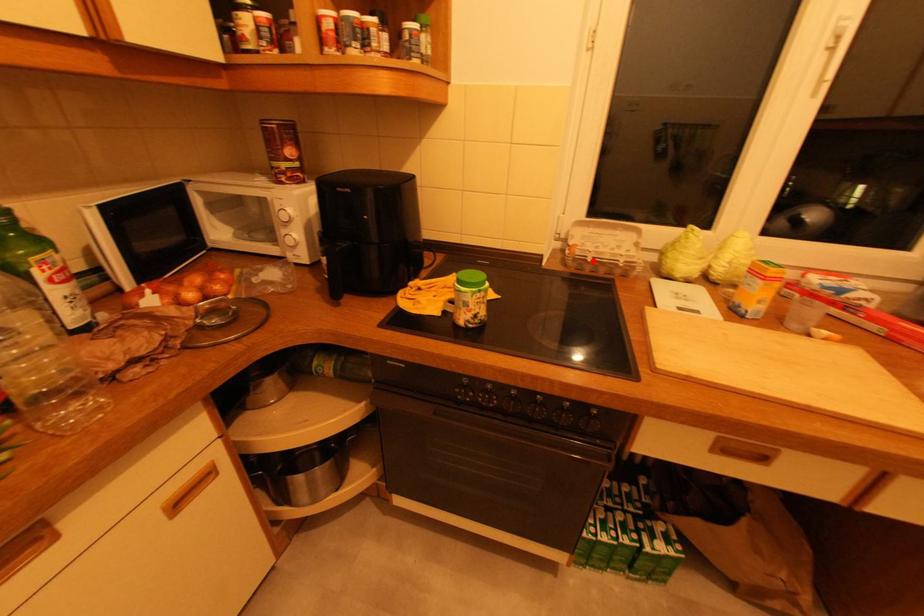
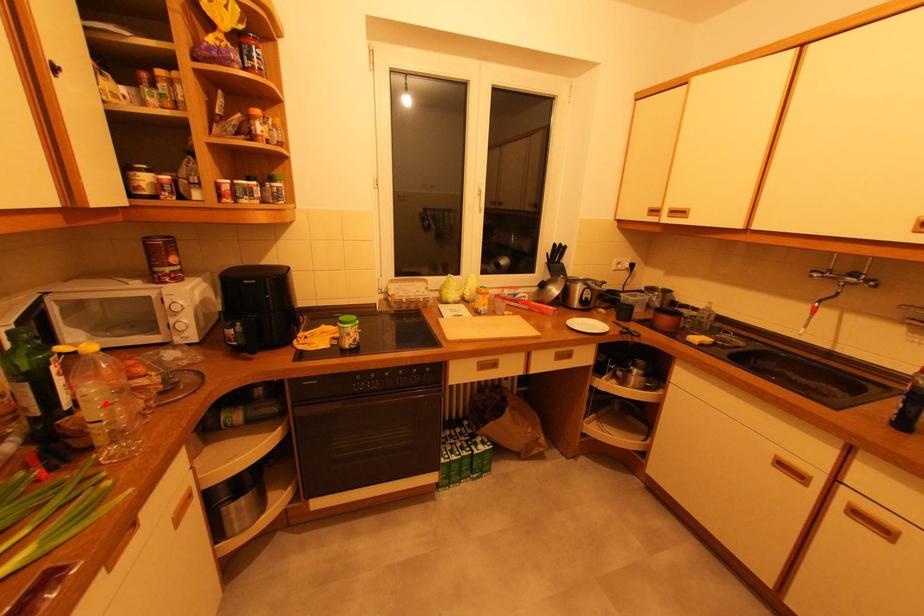
I am providing you with two images of the same scene from different viewpoints. A red point is marked on the first image and another point is marked on the second image. Is the marked point in image1 the same physical position as the marked point in image2?

No